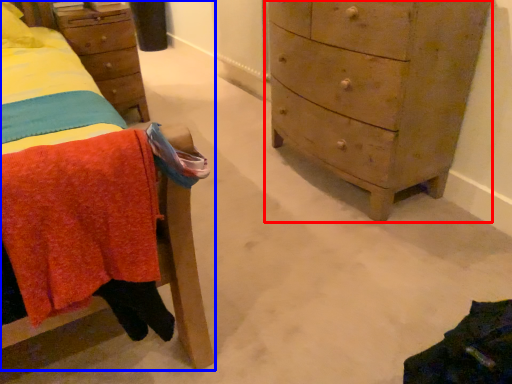
Question: Which object appears farthest to the camera in this image, chest of drawers (highlighted by a red box) or furniture (highlighted by a blue box)?

Choices:
 (A) chest of drawers
 (B) furniture

Answer: (A)